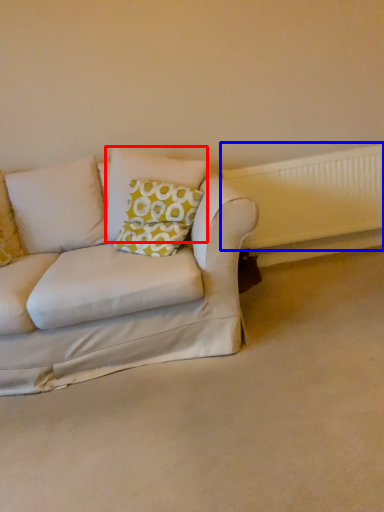
Question: Which object appears closest to the camera in this image, pillow (highlighted by a red box) or radiator (highlighted by a blue box)?

Choices:
 (A) pillow
 (B) radiator

Answer: (A)